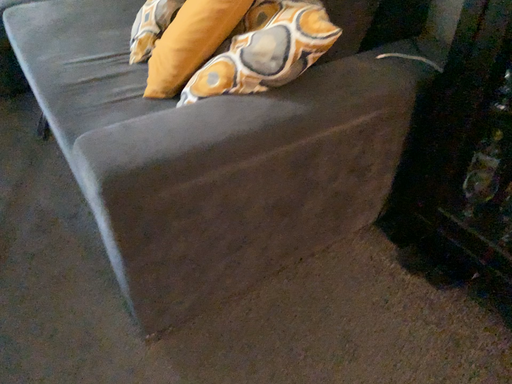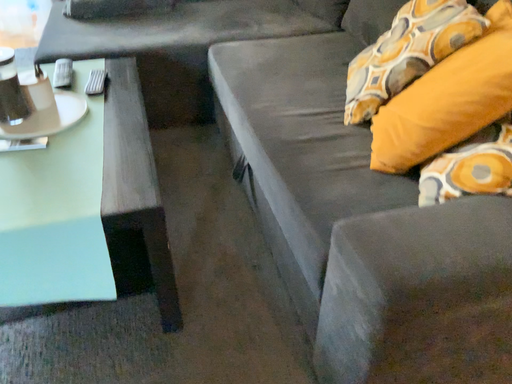
Question: How did the camera likely rotate when shooting the video?

Choices:
 (A) rotated right
 (B) rotated left

Answer: (B)